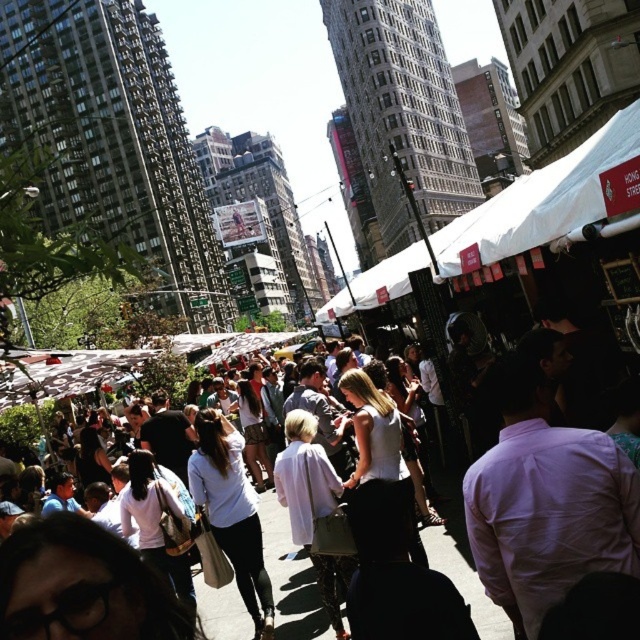
You are standing at the center of the bustling New York City street scene depicted in the image. There is a white fabric canopy at upper center marked by point (506, 220). If you want to move towards this canopy, which direction should you walk?

The white fabric canopy at upper center is located above and in front of you, so you should walk forward towards it.

Based on the photo, you are a photographer standing at the edge of the market. You want to take a photo of the white fabric canopy at upper center and the white cotton crowd at center. Which object will appear larger in your photo?

The white fabric canopy at upper center will appear larger in the photo because it is much taller than the white cotton crowd at center.